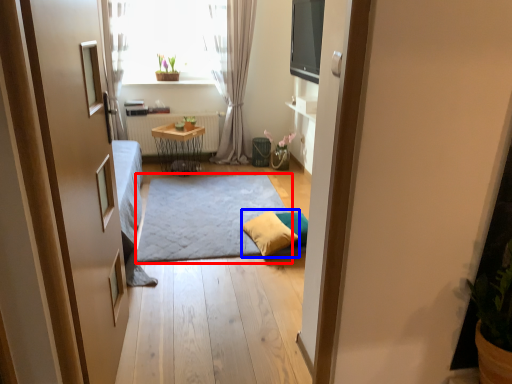
Question: Among these objects, which one is nearest to the camera, doormat (highlighted by a red box) or pillow (highlighted by a blue box)?

Choices:
 (A) doormat
 (B) pillow

Answer: (A)